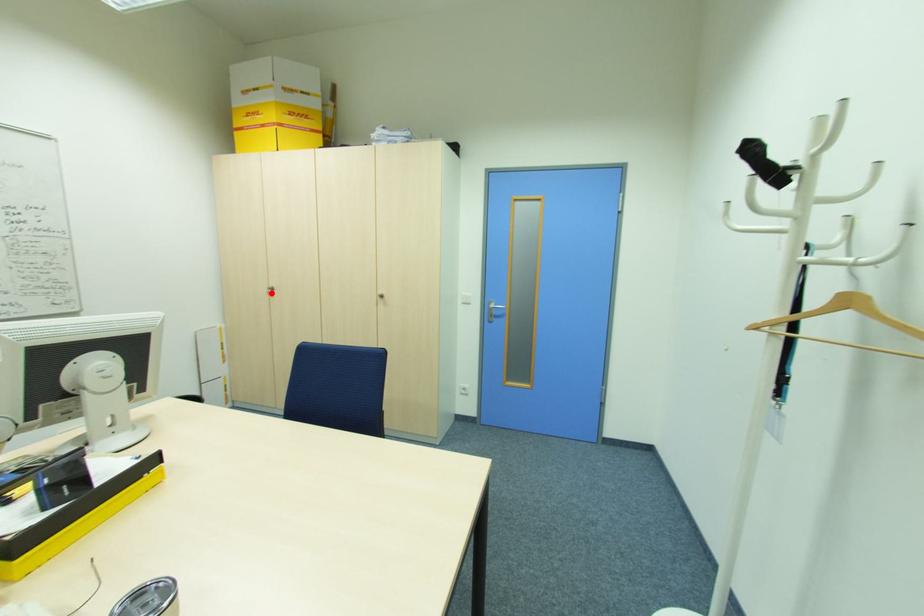
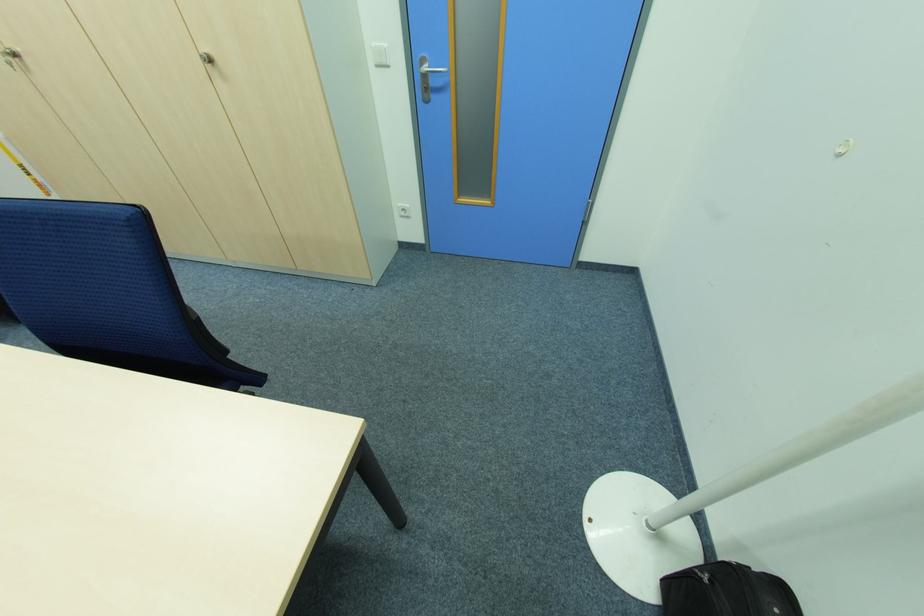
In the second image, find the point that corresponds to the highlighted location in the first image.

(14, 65)